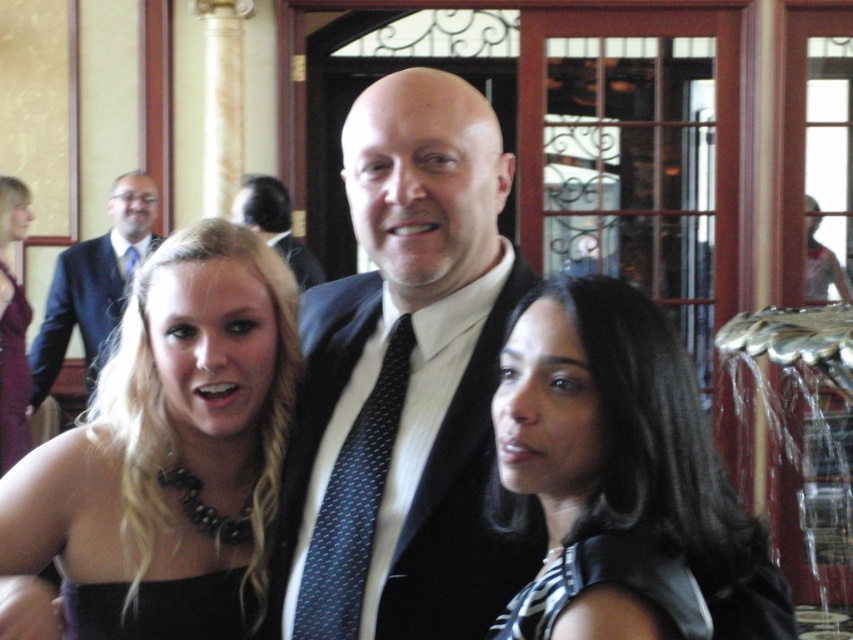
Is matte black suit at upper left above black satin dress at lower left?

Indeed, matte black suit at upper left is positioned over black satin dress at lower left.

What do you see at coordinates (93, 284) in the screenshot?
I see `matte black suit at upper left` at bounding box center [93, 284].

Find the location of a particular element. matte black suit at upper left is located at coordinates (93, 284).

Is point (170, 493) less distant than point (572, 433)?

No, (170, 493) is further to viewer.

Does matte black dress at center have a lesser width compared to black leather vest at center?

No, matte black dress at center is not thinner than black leather vest at center.

Identify the location of matte black dress at center. The image size is (853, 640). (171, 429).

In the scene shown: Does black silk tie at center have a lesser width compared to maroon satin dress at left?

In fact, black silk tie at center might be wider than maroon satin dress at left.

Who is positioned more to the right, black silk tie at center or maroon satin dress at left?

black silk tie at center

Identify the location of black silk tie at center. (352, 502).